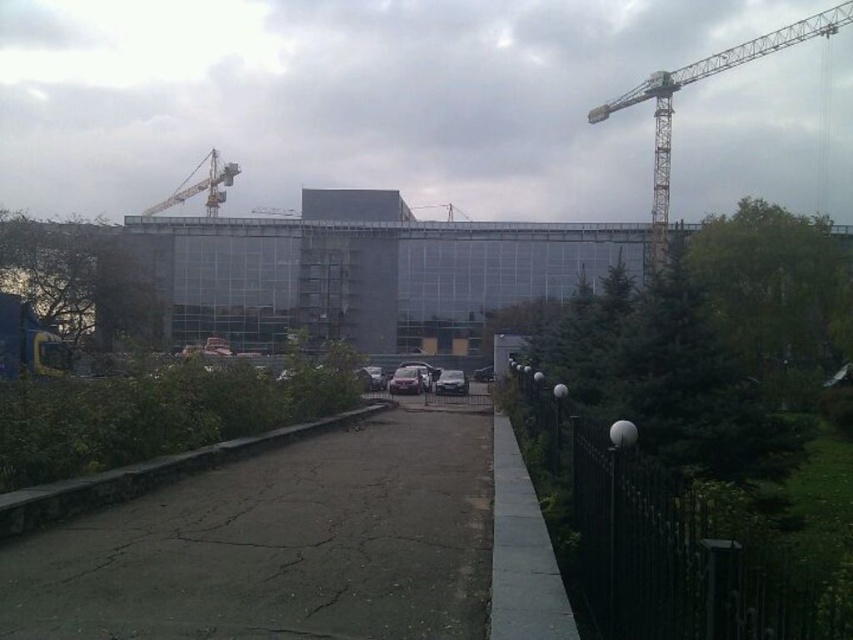
Which is above, yellow metallic crane at upper right or metallic yellow crane at center?

yellow metallic crane at upper right

The image size is (853, 640). What do you see at coordinates (692, 83) in the screenshot? I see `yellow metallic crane at upper right` at bounding box center [692, 83].

Measure the distance between point (660, 196) and camera.

Point (660, 196) is 73.03 meters away from camera.

The height and width of the screenshot is (640, 853). Find the location of `yellow metallic crane at upper right`. yellow metallic crane at upper right is located at coordinates (692, 83).

Is satin silver sedan at center wider than metallic yellow crane at center?

In fact, satin silver sedan at center might be narrower than metallic yellow crane at center.

Based on the photo, is satin silver sedan at center behind metallic yellow crane at center?

That is False.

Which is in front, point (453, 381) or point (445, 209)?

Point (453, 381) is in front.

In order to click on satin silver sedan at center in this screenshot , I will do `click(451, 381)`.

Which is more to the left, metallic yellow crane at upper left or metallic yellow crane at center?

From the viewer's perspective, metallic yellow crane at upper left appears more on the left side.

Between point (224, 163) and point (436, 204), which one is positioned in front?

Point (436, 204)

What do you see at coordinates (202, 186) in the screenshot? I see `metallic yellow crane at upper left` at bounding box center [202, 186].

I want to click on metallic yellow crane at upper left, so click(x=202, y=186).